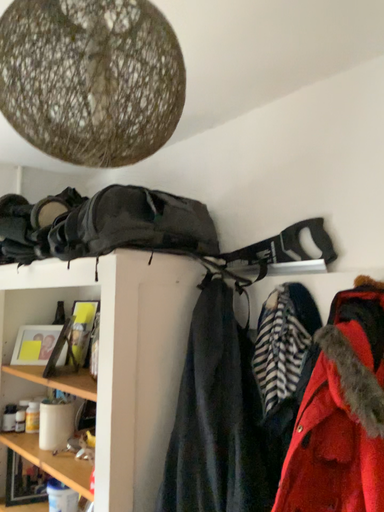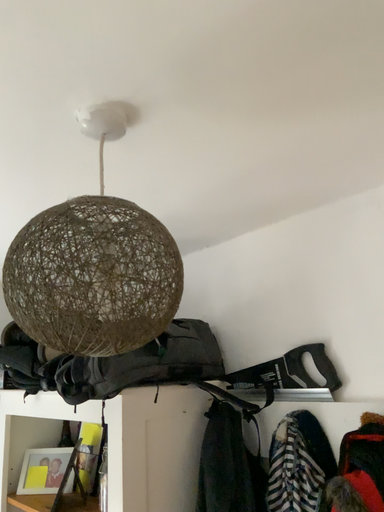
Question: Which way did the camera rotate in the video?

Choices:
 (A) rotated downward
 (B) rotated upward

Answer: (B)